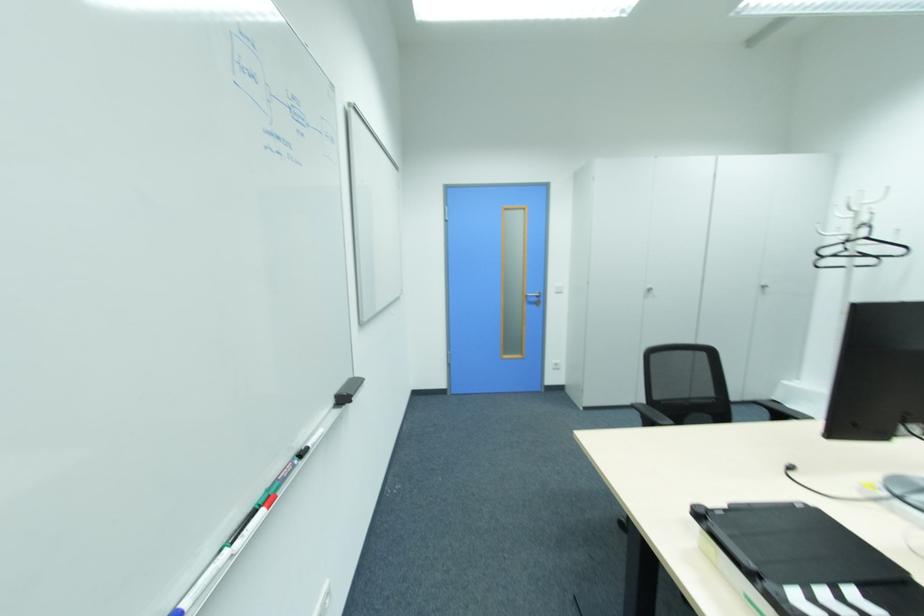
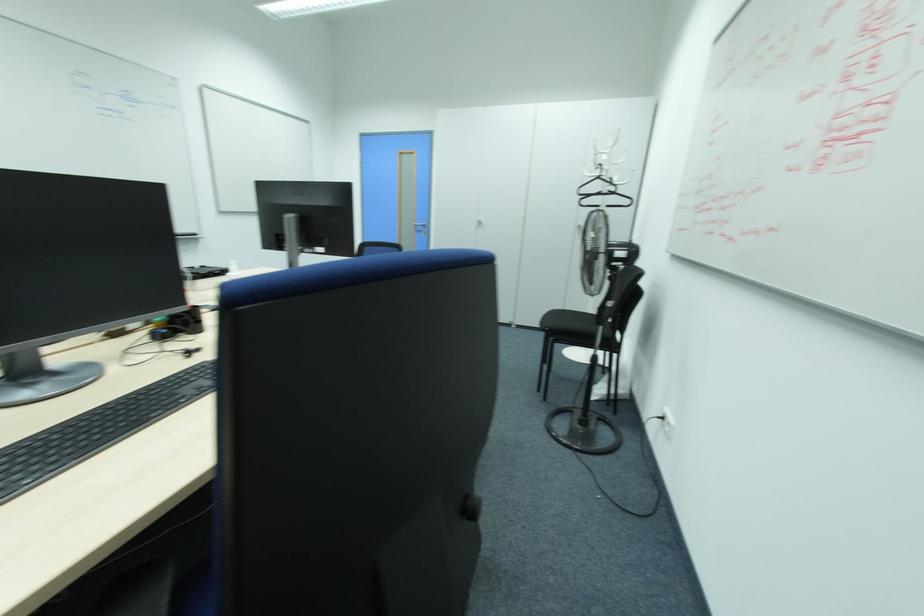
Find the pixel in the second image that matches (865,238) in the first image.

(599, 177)